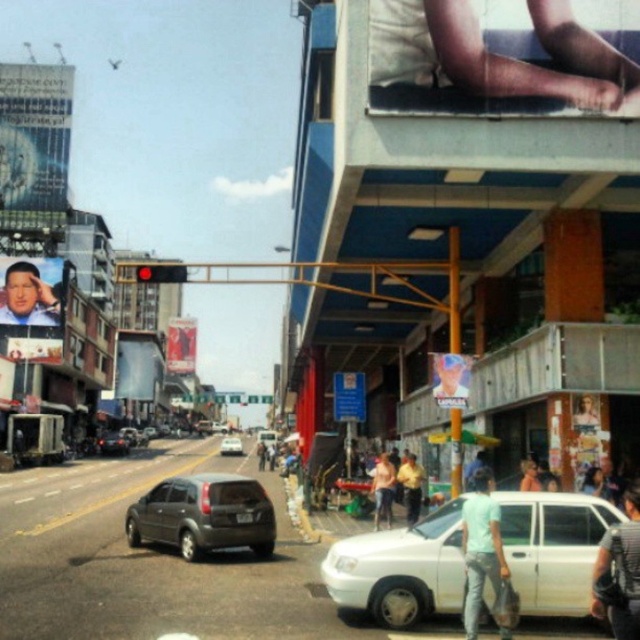
You are standing on the elevated walkway on the right side of the street. You see two points in the scene, point [451,557] and point [177,371]. Which point is closer to you?

Point [451,557] is closer to the viewer than point [177,371].

You are a delivery person who needs to park your white matte sedan at lower center as close as possible to the overpass on the right side. Based on its current position, can you estimate how far you are from the overpass? Please provide your answer in meters, assuming the scene is scaled to real world dimensions where 1 unit in the coordinate system corresponds to 10 meters.

The white matte sedan at lower center is located at coordinates [401,570]. To determine the distance to the overpass on the right side, we need to calculate the Euclidean distance between the sedan and the overpass. However, the exact coordinates of the overpass are not provided in the scene description. Without this information, it is impossible to calculate the precise distance in meters. Please provide the coordinates of the overpass to proceed with the calculation.

You are a delivery driver needing to park your white matte sedan at lower center. There is a metallic silver statue at center in the way. Can you move the statue to make space?

The white matte sedan at lower center is positioned over the metallic silver statue at center, meaning the statue is already beneath the car. Since the car is already occupying the space where the statue is located, you cannot move the statue to make space as it is already under the sedan.